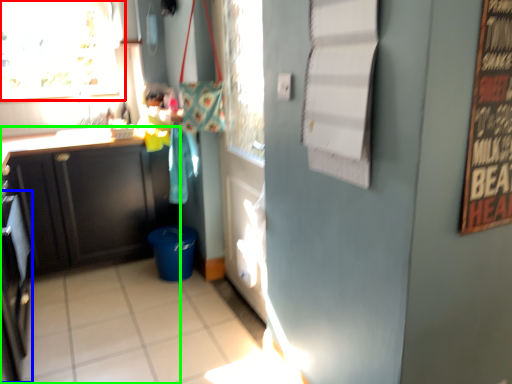
Question: Which object is the closest to the window (highlighted by a red box)? Choose among these: appliance (highlighted by a blue box) or cabinetry (highlighted by a green box).

Choices:
 (A) appliance
 (B) cabinetry

Answer: (B)